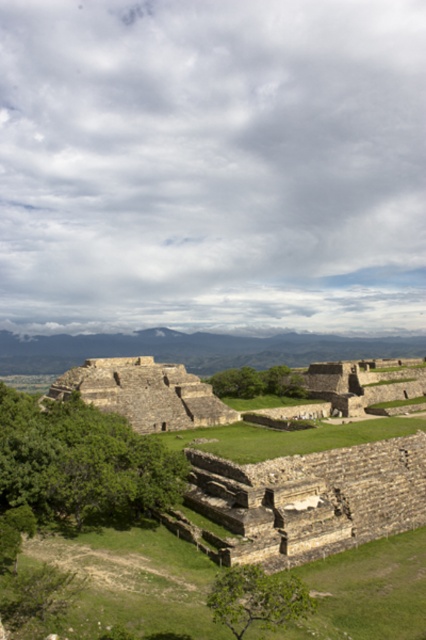
Question: Which object is closer to the camera taking this photo?

Choices:
 (A) stone ruins at center
 (B) stone wall at center
 (C) brown stone pyramid at center
 (D) green grassy at center

Answer: (B)

Question: Based on their relative distances, which object is nearer to the stone wall at center?

Choices:
 (A) stone ruins at center
 (B) brown stone pyramid at center

Answer: (B)

Question: Is the position of stone wall at center less distant than that of brown stone pyramid at center?

Choices:
 (A) no
 (B) yes

Answer: (B)

Question: Can you confirm if stone ruins at center is smaller than brown stone pyramid at center?

Choices:
 (A) no
 (B) yes

Answer: (A)

Question: Does stone ruins at center have a smaller size compared to brown stone pyramid at center?

Choices:
 (A) no
 (B) yes

Answer: (A)

Question: Which of the following is the closest to the observer?

Choices:
 (A) (241, 461)
 (B) (118, 385)
 (C) (247, 541)
 (D) (354, 337)

Answer: (C)